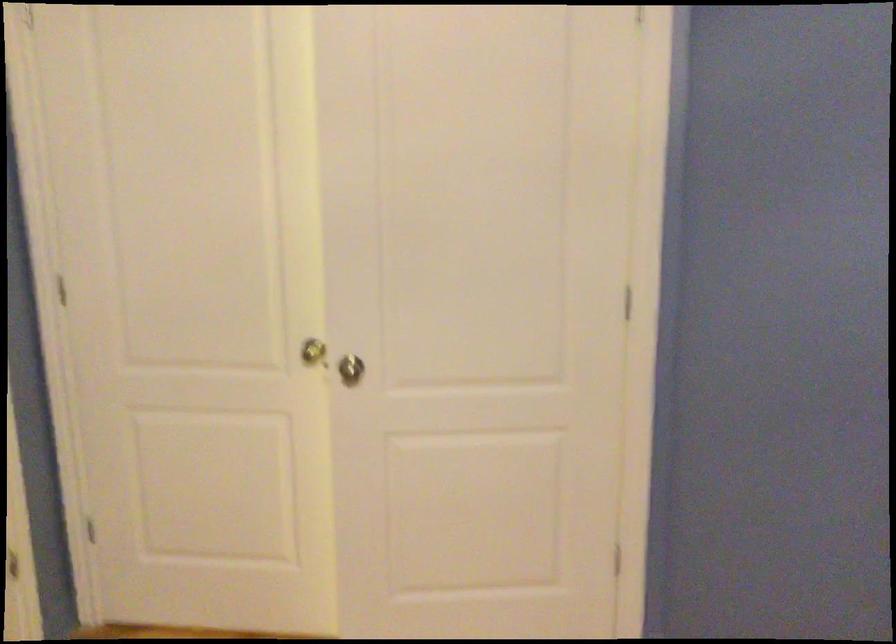
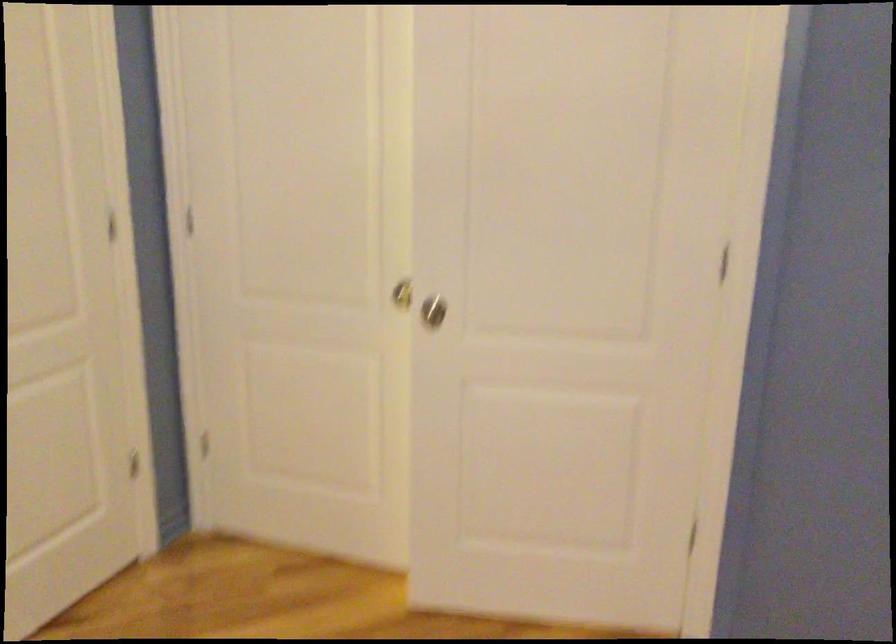
Question: The camera is either moving clockwise (left) or counter-clockwise (right) around the object. The first image is from the beginning of the video and the second image is from the end. Is the camera moving left or right when shooting the video?

Choices:
 (A) Left
 (B) Right

Answer: (B)